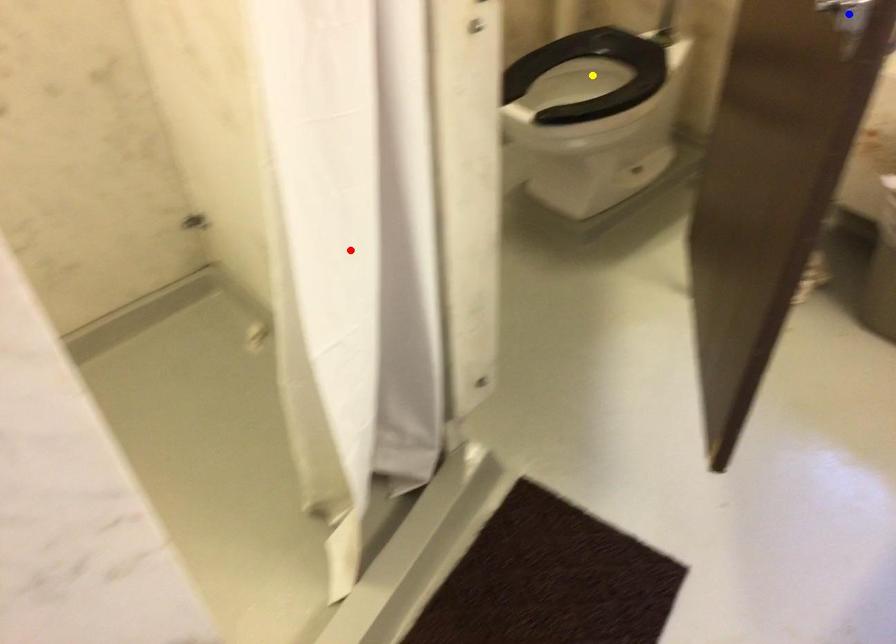
Based on the photo, order these from nearest to farthest:
red point
blue point
yellow point

blue point
red point
yellow point